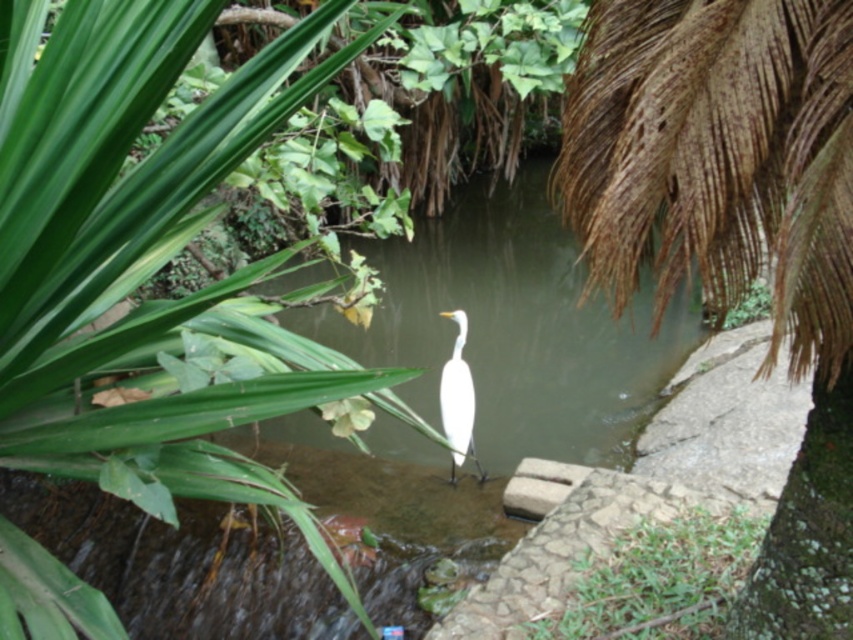
Question: Can you confirm if green leafy palm tree at center-left is smaller than white smooth bird at center?

Choices:
 (A) no
 (B) yes

Answer: (A)

Question: Which point is closer to the camera?

Choices:
 (A) white smooth bird at center
 (B) green grass at lower center
 (C) brown/dried palm fronds at upper right

Answer: (C)

Question: Is brown/dried palm fronds at upper right positioned in front of green grass at lower center?

Choices:
 (A) no
 (B) yes

Answer: (B)

Question: Can you confirm if green grass at lower center is positioned to the right of white smooth bird at center?

Choices:
 (A) yes
 (B) no

Answer: (A)

Question: Which point is farther to the camera?

Choices:
 (A) green grass at lower center
 (B) brown/dried palm fronds at upper right

Answer: (A)

Question: Which of the following is the farthest from the observer?

Choices:
 (A) (480, 468)
 (B) (685, 636)

Answer: (A)